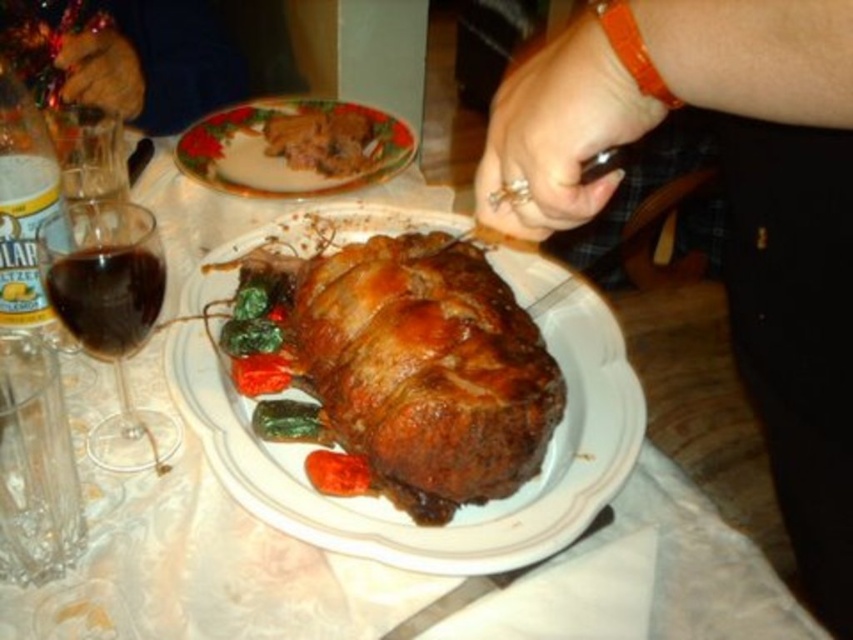
Who is more distant from viewer, [424,477] or [74,310]?

The point [74,310] is behind.

Does golden brown roasted meat at center have a larger size compared to transparent glass at left?

Yes.

The image size is (853, 640). Find the location of `golden brown roasted meat at center`. golden brown roasted meat at center is located at coordinates (425, 369).

Where is `golden brown roasted meat at center`? The height and width of the screenshot is (640, 853). golden brown roasted meat at center is located at coordinates (425, 369).

Which of these two, golden brown ceramic roast at center or dark red liquid at left, stands taller?

Standing taller between the two is golden brown ceramic roast at center.

Is golden brown ceramic roast at center positioned at the back of dark red liquid at left?

No.

Which is behind, point (207, 282) or point (132, 339)?

The point (207, 282) is behind.

This screenshot has width=853, height=640. In order to click on golden brown ceramic roast at center in this screenshot , I will do `click(383, 499)`.

Does green leafy vegetable at center come in front of green glossy vegetable at center?

No, green leafy vegetable at center is behind green glossy vegetable at center.

Can you confirm if green leafy vegetable at center is taller than green glossy vegetable at center?

Yes.

Identify the location of green leafy vegetable at center. This screenshot has width=853, height=640. (289, 422).